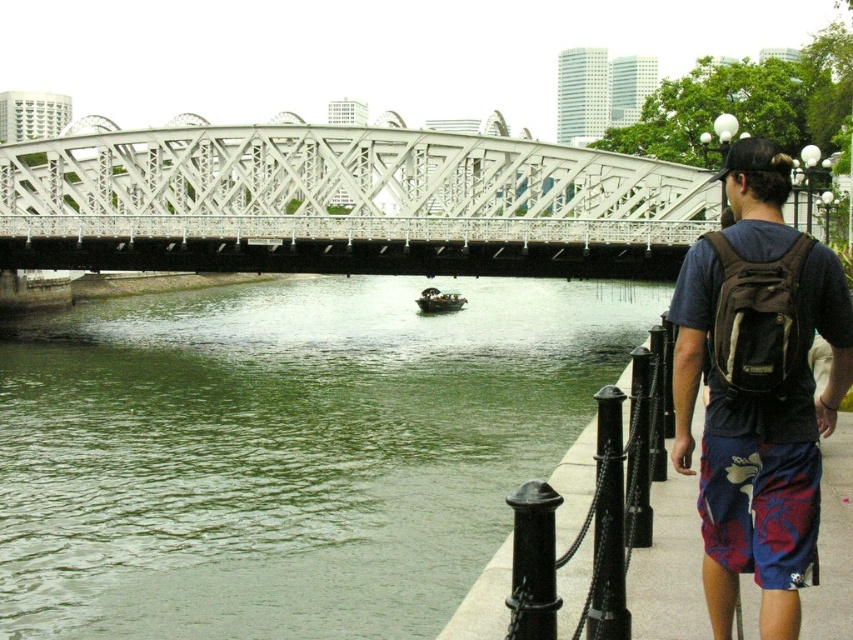
Question: Does green water at center have a lesser width compared to dark blue fabric backpack at right?

Choices:
 (A) no
 (B) yes

Answer: (A)

Question: Among these objects, which one is farthest from the camera?

Choices:
 (A) dark blue fabric backpack at right
 (B) floral print shorts at lower right
 (C) wooden boat at center
 (D) green water at center

Answer: (C)

Question: Can you confirm if green water at center is positioned to the right of floral print shorts at lower right?

Choices:
 (A) yes
 (B) no

Answer: (B)

Question: Which is nearer to the wooden boat at center?

Choices:
 (A) green water at center
 (B) floral print shorts at lower right

Answer: (A)

Question: Which object appears farthest from the camera in this image?

Choices:
 (A) floral print shorts at lower right
 (B) wooden boat at center
 (C) dark blue fabric backpack at right

Answer: (B)

Question: Is green water at center above wooden boat at center?

Choices:
 (A) yes
 (B) no

Answer: (B)